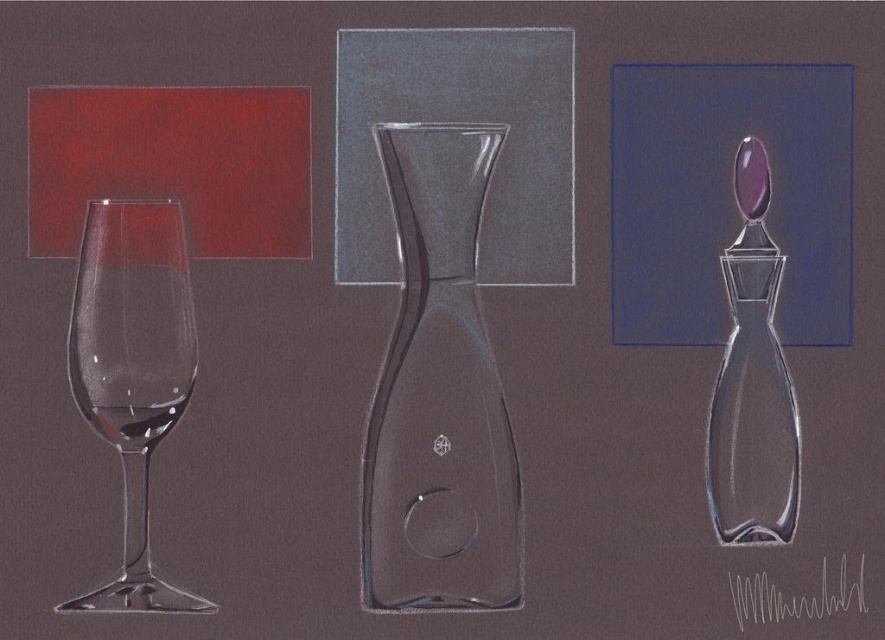
Question: Is transparent glass carafe at center positioned at the back of transparent glass bottle at right?

Choices:
 (A) no
 (B) yes

Answer: (A)

Question: Can you confirm if transparent glass carafe at center is positioned above transparent glass wine glass at left?

Choices:
 (A) yes
 (B) no

Answer: (A)

Question: Observing the image, what is the correct spatial positioning of transparent glass carafe at center in reference to transparent glass wine at left?

Choices:
 (A) right
 (B) left

Answer: (A)

Question: Which object is closer to the camera taking this photo?

Choices:
 (A) transparent glass carafe at center
 (B) transparent glass wine glass at left

Answer: (B)

Question: Which point is farther to the camera?

Choices:
 (A) transparent glass wine at left
 (B) transparent glass bottle at right

Answer: (B)

Question: Which of the following is the closest to the observer?

Choices:
 (A) transparent glass wine at left
 (B) transparent glass carafe at center
 (C) transparent glass bottle at right
 (D) transparent glass wine glass at left

Answer: (D)